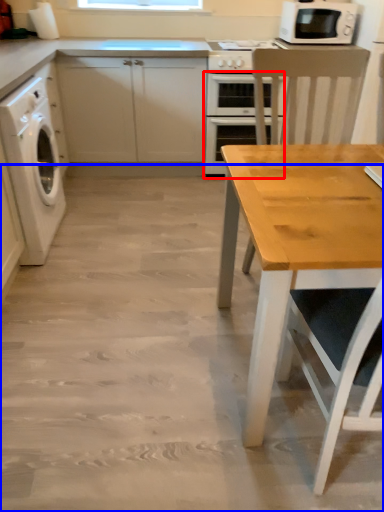
Question: Which of the following is the closest to the observer, oven (highlighted by a red box) or concrete (highlighted by a blue box)?

Choices:
 (A) oven
 (B) concrete

Answer: (B)